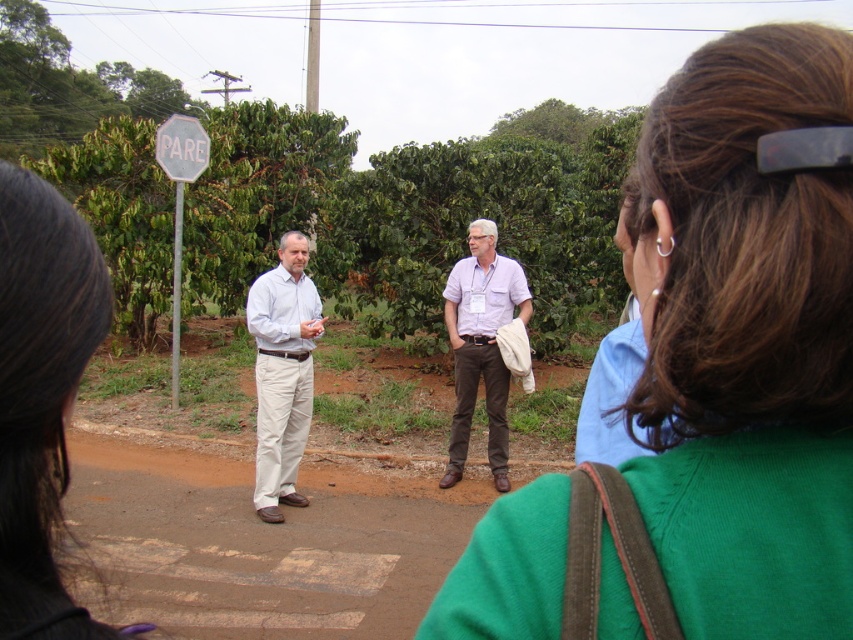
Question: Can you confirm if black hair at upper left is smaller than matte white shirt at center?

Choices:
 (A) no
 (B) yes

Answer: (B)

Question: Observing the image, what is the correct spatial positioning of matte white shirt at center in reference to light purple shirt at center?

Choices:
 (A) left
 (B) right

Answer: (A)

Question: Which point is closer to the camera?

Choices:
 (A) (22, 320)
 (B) (808, 400)
 (C) (257, 305)

Answer: (A)

Question: Which object is the farthest from the black hair at upper left?

Choices:
 (A) matte white shirt at center
 (B) green fabric at center
 (C) light purple shirt at center

Answer: (C)

Question: Can you confirm if green fabric at center is positioned to the right of black hair at upper left?

Choices:
 (A) no
 (B) yes

Answer: (B)

Question: Which of the following is the closest to the observer?

Choices:
 (A) light purple shirt at center
 (B) matte white shirt at center

Answer: (B)